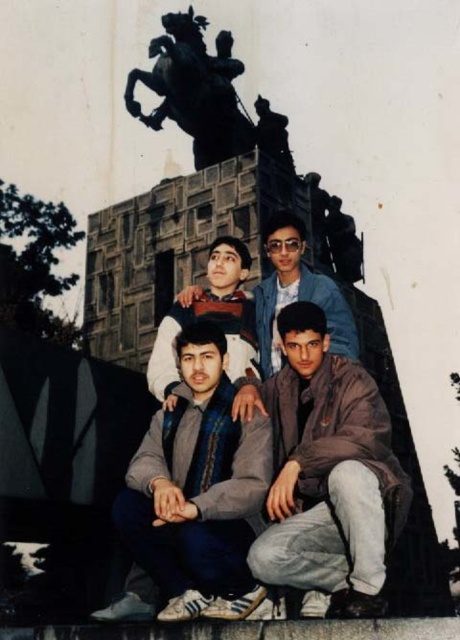
What do you see at coordinates (327, 472) in the screenshot? I see `gray matte jacket at lower right` at bounding box center [327, 472].

Find the location of a particular element. gray matte jacket at lower right is located at coordinates (327, 472).

Consider the image. Who is more forward, (378, 593) or (182, 400)?

Positioned in front is point (378, 593).

Is gray matte jacket at lower right positioned before gray fabric jacket at lower center?

Yes.

Where is `gray matte jacket at lower right`? Image resolution: width=460 pixels, height=640 pixels. gray matte jacket at lower right is located at coordinates (327, 472).

This screenshot has height=640, width=460. I want to click on gray matte jacket at lower right, so click(x=327, y=472).

Is gray matte jacket at lower right further to camera compared to shiny blue jacket at center?

No, gray matte jacket at lower right is closer to the viewer.

Can you confirm if gray matte jacket at lower right is wider than shiny blue jacket at center?

No.

Is point (306, 362) closer to viewer compared to point (271, 275)?

Yes, point (306, 362) is in front of point (271, 275).

Where is `gray matte jacket at lower right`? gray matte jacket at lower right is located at coordinates (327, 472).